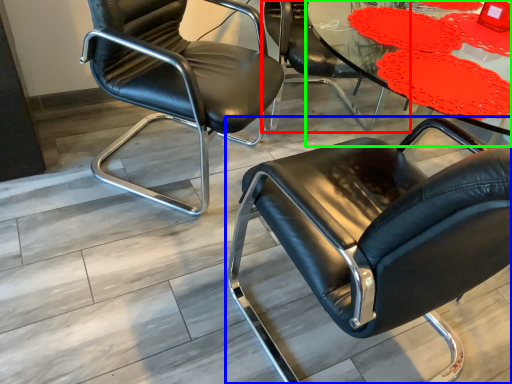
Question: Estimate the real-world distances between objects in this image. Which object is farther from chair (highlighted by a red box), chair (highlighted by a blue box) or table (highlighted by a green box)?

Choices:
 (A) chair
 (B) table

Answer: (A)